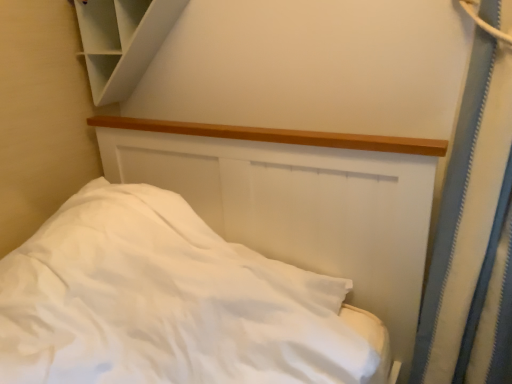
The image size is (512, 384). What do you see at coordinates (298, 200) in the screenshot? I see `white matte bed at center` at bounding box center [298, 200].

I want to click on white matte bed at center, so click(x=298, y=200).

Describe the element at coordinates (122, 41) in the screenshot. I see `white matte cabinet at upper left` at that location.

Identify the location of white matte cabinet at upper left. (x=122, y=41).

What is the approximate width of white matte cabinet at upper left?

white matte cabinet at upper left is 5.98 inches in width.

Where is `white matte bed at center`? The height and width of the screenshot is (384, 512). white matte bed at center is located at coordinates (298, 200).

Does white matte bed at center appear on the right side of white matte cabinet at upper left?

Indeed, white matte bed at center is positioned on the right side of white matte cabinet at upper left.

Between white matte bed at center and white matte cabinet at upper left, which one is positioned behind?

Positioned behind is white matte cabinet at upper left.

Is point (333, 176) positioned in front of point (146, 18)?

Yes, it is.

From the image's perspective, between white matte bed at center and white matte cabinet at upper left, who is located below?

From the image's view, white matte bed at center is below.

Looking at this image, from a real-world perspective, is white matte bed at center physically located above or below white matte cabinet at upper left?

white matte bed at center is below white matte cabinet at upper left.

Which object is thinner, white matte bed at center or white matte cabinet at upper left?

With smaller width is white matte cabinet at upper left.

Looking at this image, can you confirm if white matte bed at center is taller than white matte cabinet at upper left?

Yes, white matte bed at center is taller than white matte cabinet at upper left.

Who is bigger, white matte bed at center or white matte cabinet at upper left?

Bigger between the two is white matte bed at center.

Is white matte cabinet at upper left located within white matte bed at center?

No.

Does white matte bed at center touch white matte cabinet at upper left?

There is a gap between white matte bed at center and white matte cabinet at upper left.

Does white matte bed at center turn towards white matte cabinet at upper left?

No.

Measure the distance between white matte bed at center and white matte cabinet at upper left.

They are 16.75 inches apart.

You are a GUI agent. You are given a task and a screenshot of the screen. Output one action in this format:
    pyautogui.click(x=<x>, y=<y>)
    Task: Click on the cabinet located above the white matte bed at center (from a real-world perspective)
    This screenshot has width=512, height=384.
    Given the screenshot: What is the action you would take?
    pyautogui.click(x=122, y=41)

Considering the positions of objects white matte cabinet at upper left and white matte bed at center in the image provided, who is more to the right, white matte cabinet at upper left or white matte bed at center?

white matte bed at center.

Relative to white matte bed at center, is white matte cabinet at upper left in front or behind?

white matte cabinet at upper left is positioned farther from the viewer than white matte bed at center.

Does point (106, 47) come farther from viewer compared to point (179, 130)?

Yes, it is behind point (179, 130).

From the image's perspective, which one is positioned higher, white matte cabinet at upper left or white matte bed at center?

white matte cabinet at upper left appears higher in the image.

Consider the image. From a real-world perspective, is white matte cabinet at upper left positioned over white matte bed at center based on gravity?

Indeed, from a real-world perspective, white matte cabinet at upper left stands above white matte bed at center.

Does white matte cabinet at upper left have a lesser width compared to white matte bed at center?

Indeed, white matte cabinet at upper left has a lesser width compared to white matte bed at center.

In terms of height, does white matte cabinet at upper left look taller or shorter compared to white matte bed at center?

white matte cabinet at upper left is shorter than white matte bed at center.

Who is smaller, white matte cabinet at upper left or white matte bed at center?

white matte cabinet at upper left.

Could white matte bed at center be considered to be inside white matte cabinet at upper left?

No, white matte bed at center is located outside of white matte cabinet at upper left.

Are white matte cabinet at upper left and white matte bed at center beside each other?

They are not placed beside each other.

Is white matte cabinet at upper left facing away from white matte bed at center?

white matte cabinet at upper left does not have its back to white matte bed at center.

Looking at this image, how much distance is there between white matte cabinet at upper left and white matte bed at center?

white matte cabinet at upper left is 42.54 centimeters away from white matte bed at center.

What are the coordinates of `cabinet located behind the white matte bed at center` in the screenshot? It's located at (122, 41).

This screenshot has width=512, height=384. Find the location of `cabinet lying behind the white matte bed at center`. cabinet lying behind the white matte bed at center is located at coordinates 122,41.

Identify the location of bed below the white matte cabinet at upper left (from the image's perspective). The height and width of the screenshot is (384, 512). (298, 200).